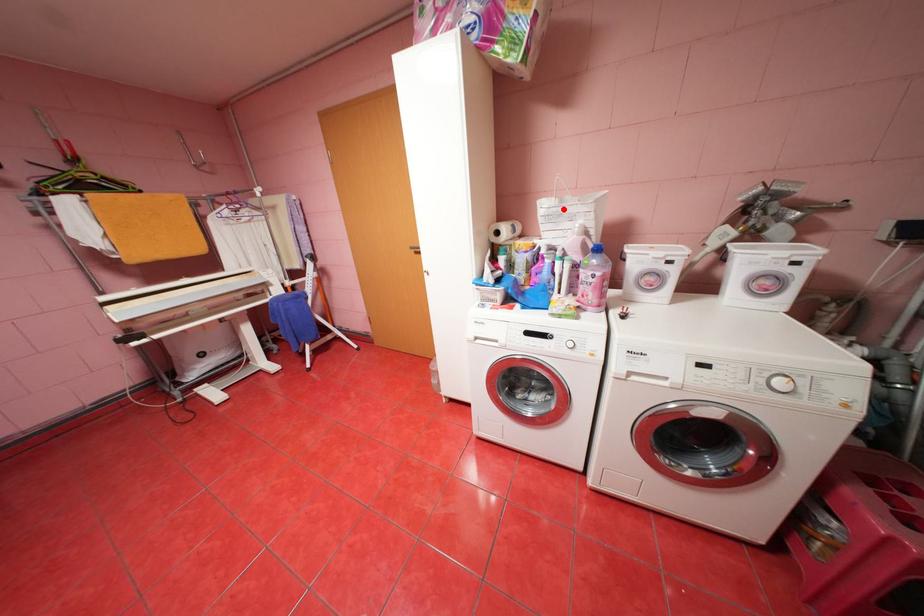
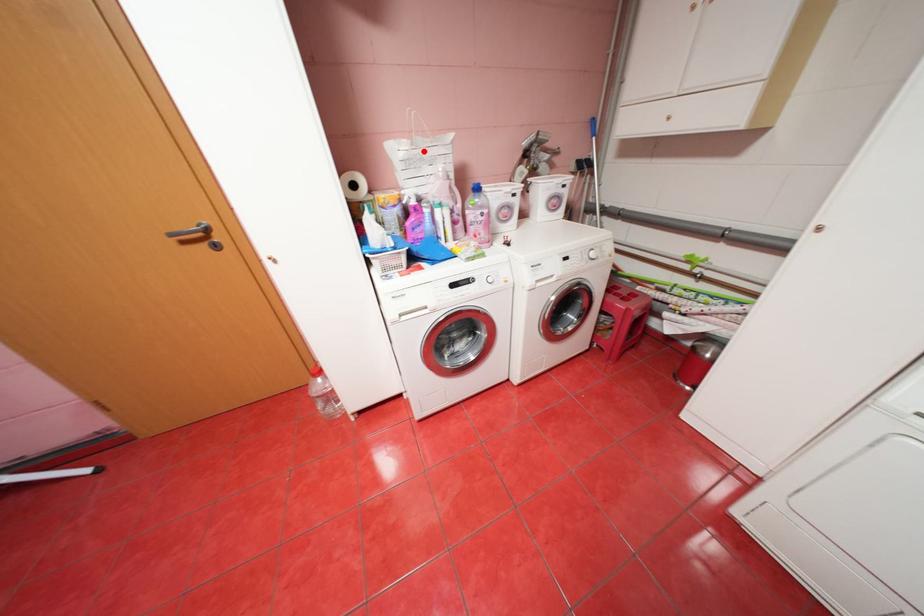
I am providing you with two images of the same scene from different viewpoints. A red point is marked on the first image and another point is marked on the second image. Are the points marked in image1 and image2 representing the same 3D position?

Yes